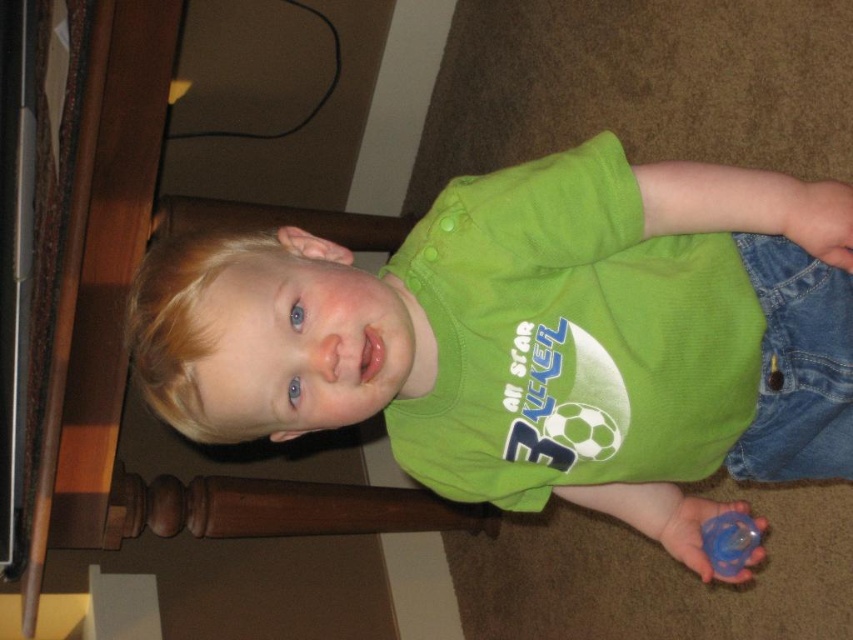
The child in the image is holding a blue rubber pacifier at lower right and wearing a green matte shirt at center. Which of these items is larger?

The green matte shirt at center is bigger than the blue rubber pacifier at lower right.